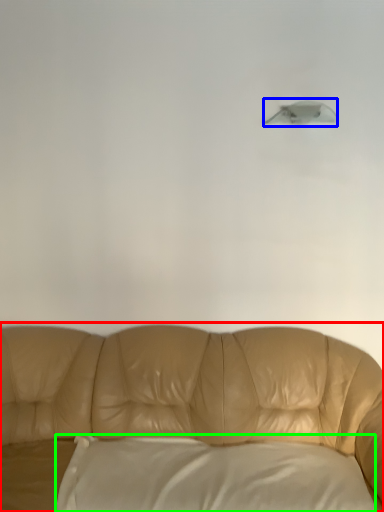
Question: Considering the real-world distances, which object is closest to studio couch (highlighted by a red box)? lamp (highlighted by a blue box) or pillow (highlighted by a green box).

Choices:
 (A) lamp
 (B) pillow

Answer: (B)